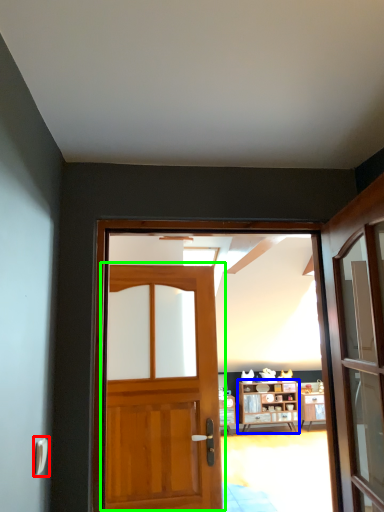
Question: Which object is positioned closest to door handle (highlighted by a red box)? Select from cabinetry (highlighted by a blue box) and door (highlighted by a green box).

Choices:
 (A) cabinetry
 (B) door

Answer: (B)